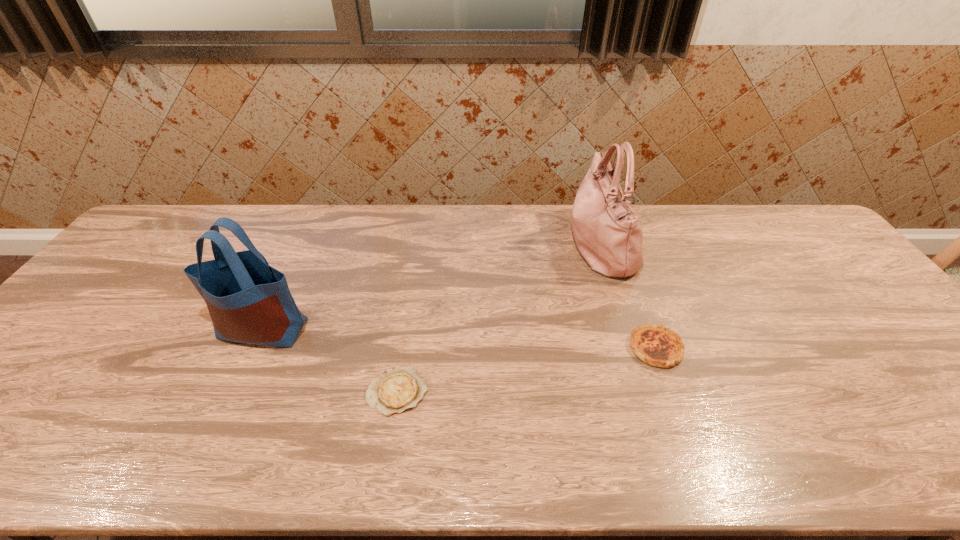
Identify the location of free space located 0.370m at the front of the right handbag with handles. The height and width of the screenshot is (540, 960). (454, 244).

Find the location of a particular element. The height and width of the screenshot is (540, 960). free region located 0.390m on the back of the left handbag is located at coordinates (312, 223).

The height and width of the screenshot is (540, 960). Find the location of `free region located on the front of the taller quiche`. free region located on the front of the taller quiche is located at coordinates 680,415.

At what (x,y) coordinates should I click in order to perform the action: click on vacant space situated 0.180m on the right of the left quiche. Please return your answer as a coordinate pair (x, y). Image resolution: width=960 pixels, height=540 pixels. Looking at the image, I should click on (505, 392).

Find the location of a particular element. object that is positioned at the far edge is located at coordinates (608, 235).

Find the location of a particular element. Image resolution: width=960 pixels, height=540 pixels. vacant space at the far edge is located at coordinates (643, 240).

I want to click on free spot at the near edge of the desktop, so coord(871,443).

Find the location of a particular element. The height and width of the screenshot is (540, 960). vacant space at the left edge of the desktop is located at coordinates (114, 297).

The height and width of the screenshot is (540, 960). Find the location of `free spot at the right edge of the desktop`. free spot at the right edge of the desktop is located at coordinates (825, 282).

Find the location of a particular element. This screenshot has height=540, width=960. free spot between the right quiche and the farther handbag is located at coordinates (628, 296).